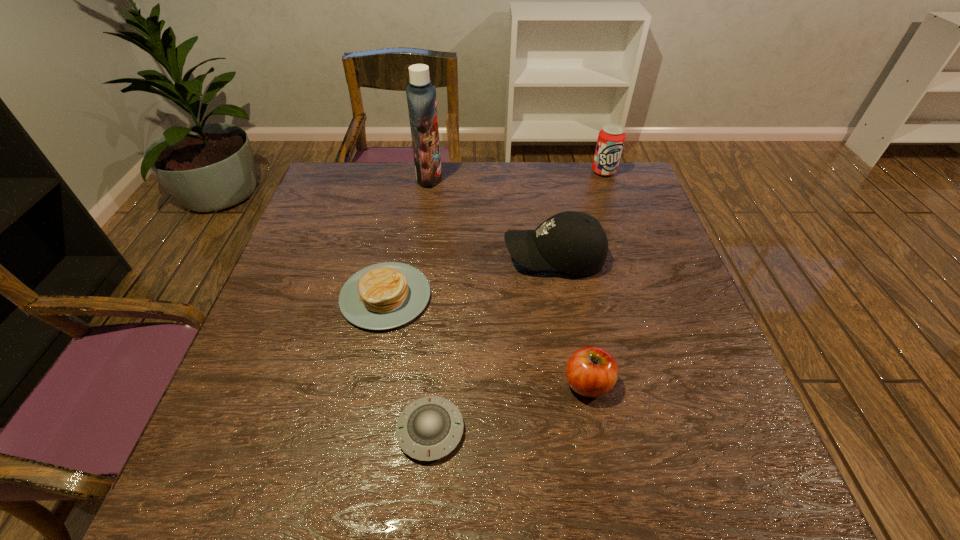
This screenshot has height=540, width=960. In the image, there is a desktop. In order to click on vacant space at the near edge in this screenshot , I will do `click(457, 483)`.

In the image, there is a desktop. Where is `vacant space at the left edge`? vacant space at the left edge is located at coordinates (314, 228).

Locate an element on the screen. The width and height of the screenshot is (960, 540). vacant space at the right edge is located at coordinates (666, 340).

Find the location of `blank area at the far left corner`. blank area at the far left corner is located at coordinates (352, 179).

At what (x,y) coordinates should I click in order to perform the action: click on vacant space at the near left corner of the desktop. Please return your answer as a coordinate pair (x, y). The width and height of the screenshot is (960, 540). Looking at the image, I should click on (221, 478).

Find the location of `free point at the near right corner`. free point at the near right corner is located at coordinates (681, 464).

Identify the location of free space between the shampoo and the second shortest object. This screenshot has height=540, width=960. (407, 237).

Identify the location of vacant area that lies between the apple and the soda can. (596, 278).

At what (x,y) coordinates should I click in order to perform the action: click on unoccupied area between the baseball cap and the saucer. Please return your answer as a coordinate pair (x, y). Looking at the image, I should click on (492, 344).

At what (x,y) coordinates should I click in order to perform the action: click on free space that is in between the apple and the tallest object. Please return your answer as a coordinate pair (x, y). The height and width of the screenshot is (540, 960). Looking at the image, I should click on (509, 280).